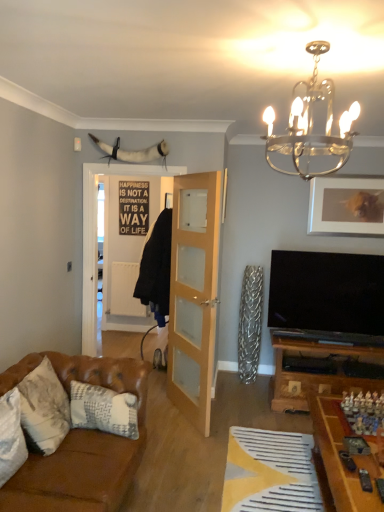
This screenshot has height=512, width=384. What are the coordinates of `empty space that is ontop of metallic chandelier at upper center (from a real-world perspective)` in the screenshot? It's located at (312, 49).